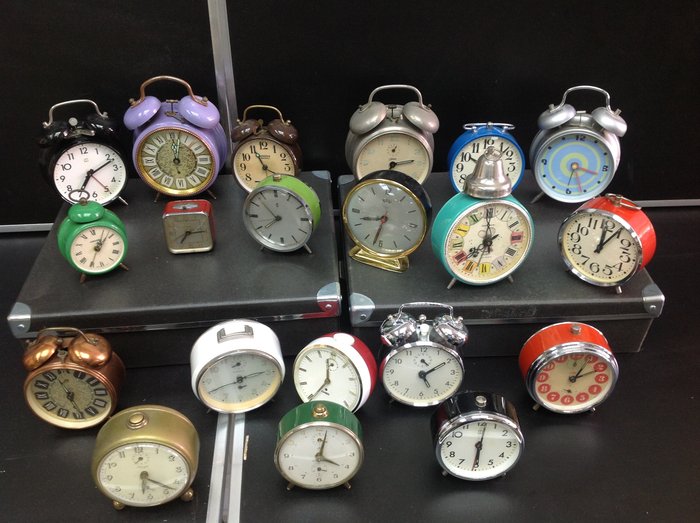
Locate an element on the screen. The image size is (700, 523). bronze clock is located at coordinates (89, 360).